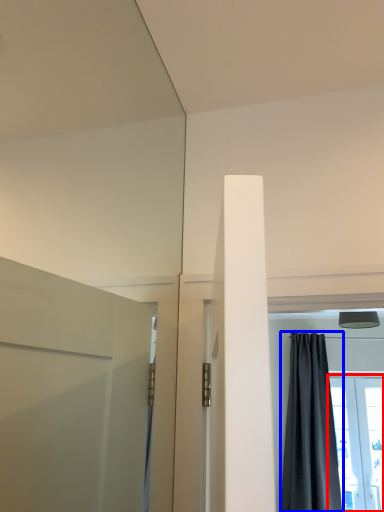
Question: Among these objects, which one is nearest to the camera, window (highlighted by a red box) or curtain (highlighted by a blue box)?

Choices:
 (A) window
 (B) curtain

Answer: (B)